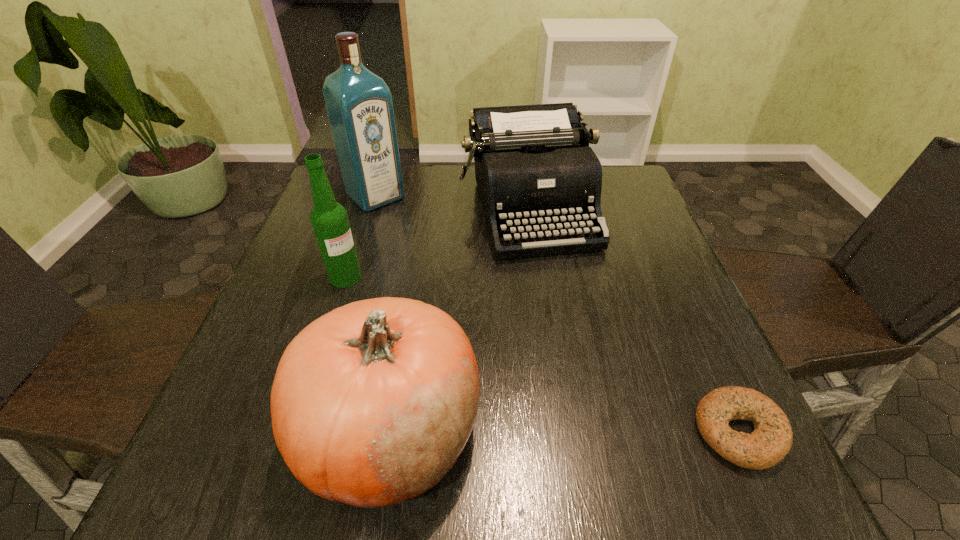
I want to click on vacant spot on the desktop that is between the pumpkin and the shortest object and is positioned on the typing side of the second shortest object, so [614, 431].

Image resolution: width=960 pixels, height=540 pixels. What are the coordinates of `vacant space on the desktop that is between the pumpkin and the rightmost object and is positioned on the label of the third nearest object` in the screenshot? It's located at (537, 431).

The height and width of the screenshot is (540, 960). What are the coordinates of `free space on the desktop that is between the pumpkin and the shortest object and is positioned on the flat label side of the tallest object` in the screenshot? It's located at (615, 431).